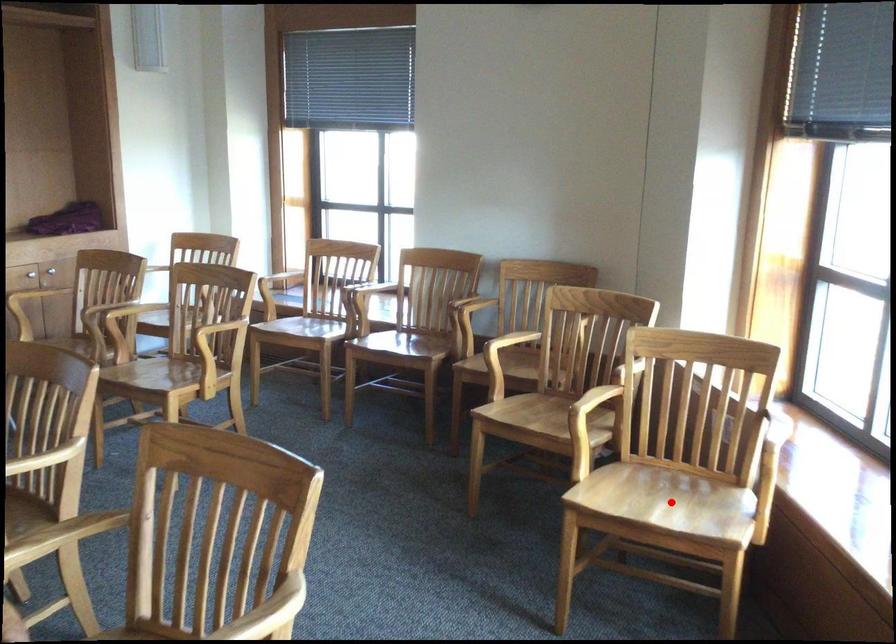
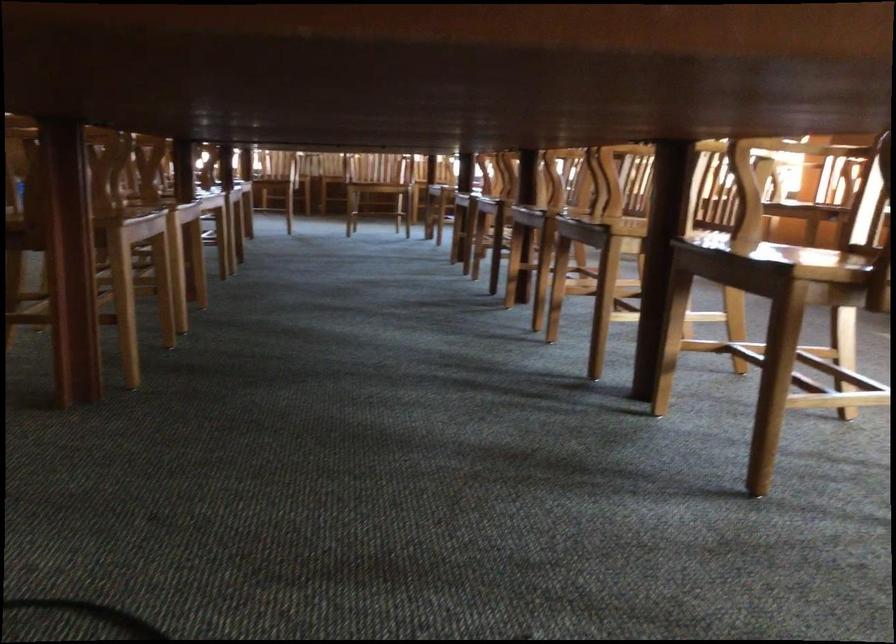
Question: I am providing you with two images of the same scene from different viewpoints. A red point is marked on the first image. At the location where the point appears in image 1, is it still visible in image 2?

Choices:
 (A) Yes
 (B) No

Answer: (B)